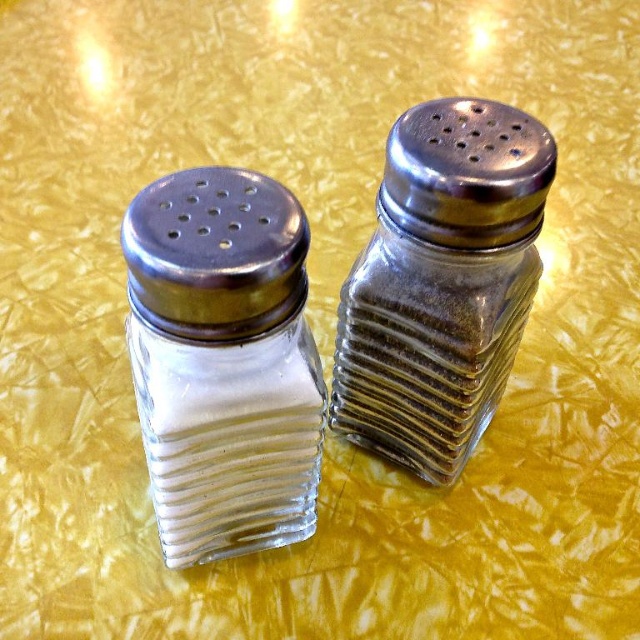
Does clear glass salt shaker at left have a greater width compared to clear glass pepper shaker at right?

In fact, clear glass salt shaker at left might be narrower than clear glass pepper shaker at right.

Does clear glass salt shaker at left have a greater height compared to clear glass pepper shaker at right?

No, clear glass salt shaker at left is not taller than clear glass pepper shaker at right.

Where is `clear glass salt shaker at left`? clear glass salt shaker at left is located at coordinates coord(224,362).